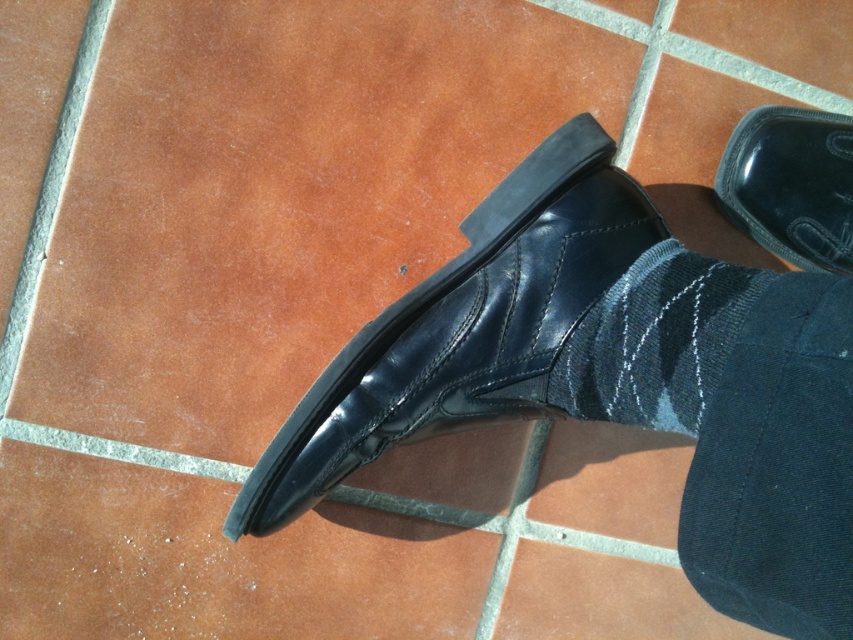
Does point (294, 600) lie behind point (502, 198)?

Yes, it is.

Who is more distant from viewer, (322, 556) or (503, 410)?

The point (322, 556) is more distant.

What are the coordinates of `brown matte tile at center` in the screenshot? It's located at (215, 561).

Between brown leather tile at center and brown matte tile at center, which one is positioned lower?

brown matte tile at center is below.

Is brown leather tile at center smaller than brown matte tile at center?

No.

Locate an element on the screen. brown leather tile at center is located at coordinates (286, 192).

Looking at this image, which of these two, brown leather tile at center or shiny black shoe at center, stands shorter?

With less height is shiny black shoe at center.

Based on the photo, which of these two, brown leather tile at center or shiny black shoe at center, stands taller?

brown leather tile at center is taller.

Locate an element on the screen. The image size is (853, 640). brown leather tile at center is located at coordinates (286, 192).

Image resolution: width=853 pixels, height=640 pixels. In order to click on brown leather tile at center in this screenshot , I will do `click(286, 192)`.